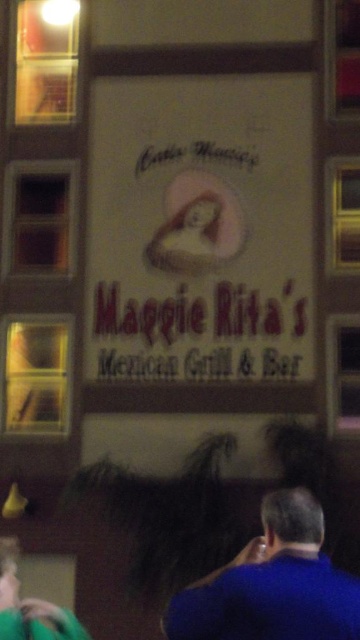
Question: Which of the following is the closest to the observer?

Choices:
 (A) (330, 637)
 (B) (203, 116)

Answer: (A)

Question: Does white paper sign at center have a greater width compared to blue fabric shirt at lower right?

Choices:
 (A) yes
 (B) no

Answer: (A)

Question: Which point is farther from the camera taking this photo?

Choices:
 (A) (277, 632)
 (B) (123, 241)

Answer: (B)

Question: Can you confirm if white paper sign at center is wider than blue fabric shirt at lower right?

Choices:
 (A) yes
 (B) no

Answer: (A)

Question: Which object is closer to the camera taking this photo?

Choices:
 (A) white paper sign at center
 (B) blue fabric shirt at lower right

Answer: (B)

Question: Can you confirm if white paper sign at center is thinner than blue fabric shirt at lower right?

Choices:
 (A) no
 (B) yes

Answer: (A)